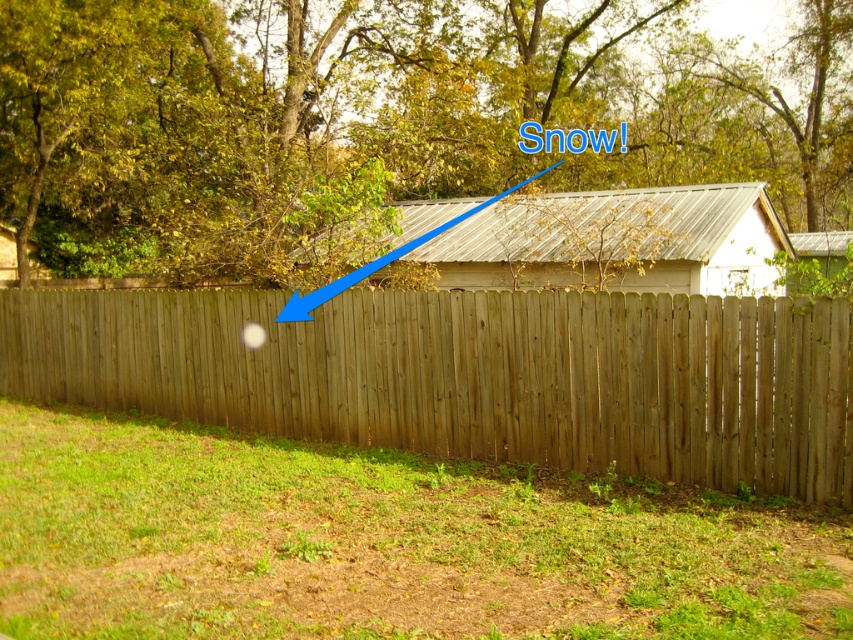
Question: Does wooden fence at center appear on the left side of metallic gray hut at center?

Choices:
 (A) yes
 (B) no

Answer: (A)

Question: Is wooden fence at center below wooden fence at lower left?

Choices:
 (A) yes
 (B) no

Answer: (A)

Question: Which object is the farthest from the wooden fence at lower left?

Choices:
 (A) wooden fence at center
 (B) metallic gray hut at center

Answer: (A)

Question: Which object is closer to the camera taking this photo?

Choices:
 (A) wooden fence at lower left
 (B) wooden fence at center

Answer: (B)

Question: Estimate the real-world distances between objects in this image. Which object is closer to the wooden fence at lower left?

Choices:
 (A) metallic gray hut at center
 (B) wooden fence at center

Answer: (A)

Question: Can you confirm if metallic gray hut at center is positioned below wooden fence at lower left?

Choices:
 (A) no
 (B) yes

Answer: (B)